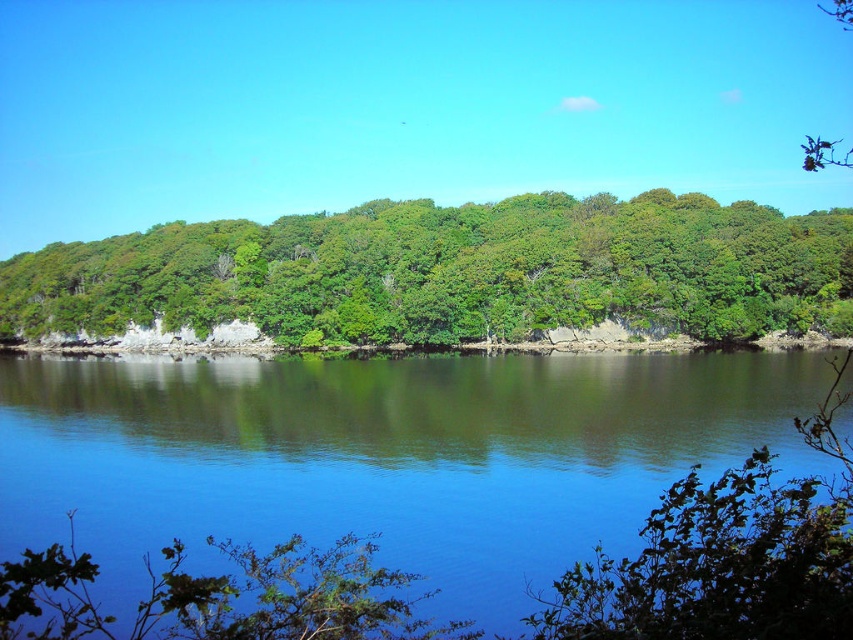
Question: Among these objects, which one is nearest to the camera?

Choices:
 (A) green leafy trees at center
 (B) smooth reflective water at center

Answer: (B)

Question: Which point is closer to the camera?

Choices:
 (A) (4, 520)
 (B) (421, 308)

Answer: (A)

Question: Is smooth reflective water at center smaller than green leafy trees at center?

Choices:
 (A) yes
 (B) no

Answer: (A)

Question: Which point appears closest to the camera in this image?

Choices:
 (A) (271, 323)
 (B) (373, 458)

Answer: (B)

Question: Can you confirm if smooth reflective water at center is smaller than green leafy trees at center?

Choices:
 (A) yes
 (B) no

Answer: (A)

Question: Can you confirm if smooth reflective water at center is positioned to the left of green leafy trees at center?

Choices:
 (A) yes
 (B) no

Answer: (B)